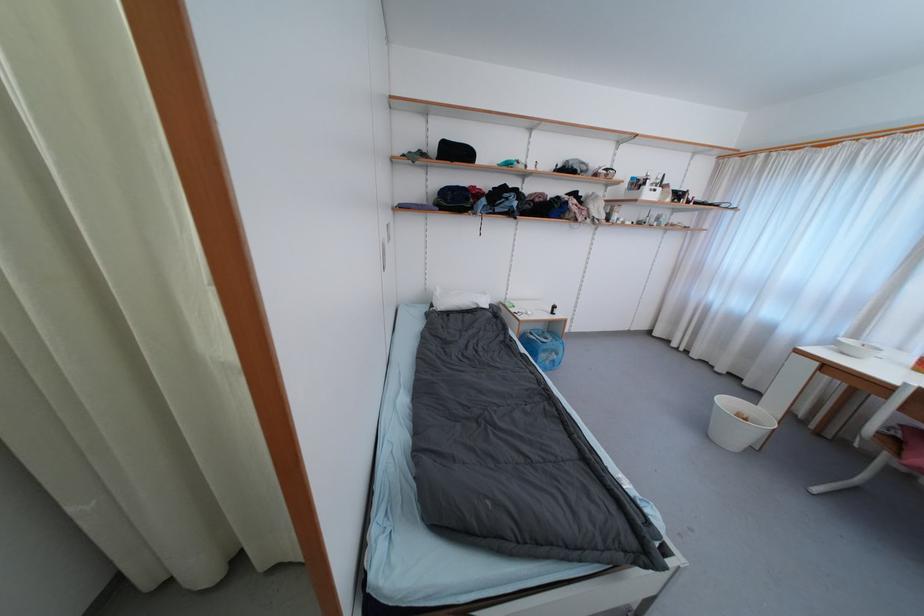
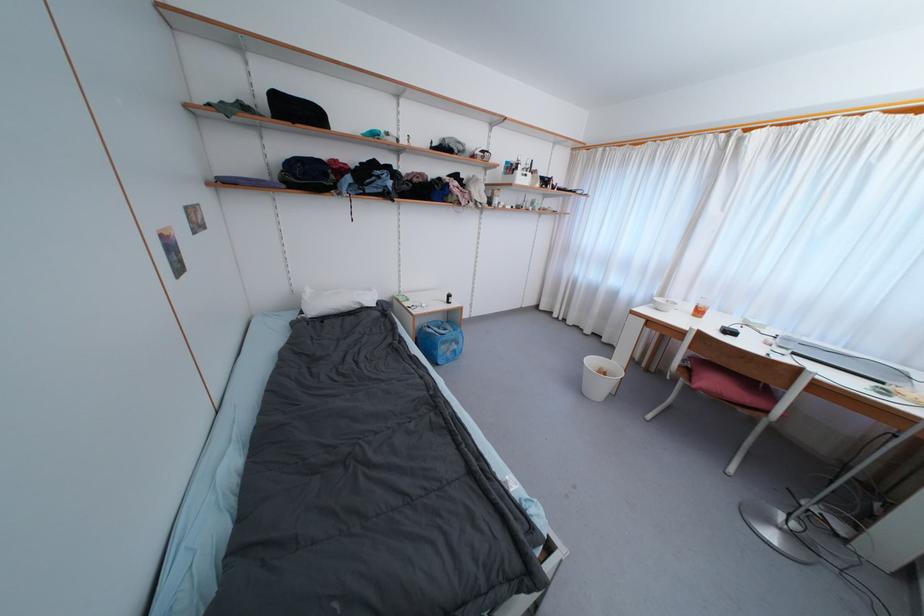
Question: Based on the continuous images, in which direction is the camera rotating? Reply with the corresponding letter.

Choices:
 (A) Left
 (B) Right
 (C) Up
 (D) Down

Answer: (B)